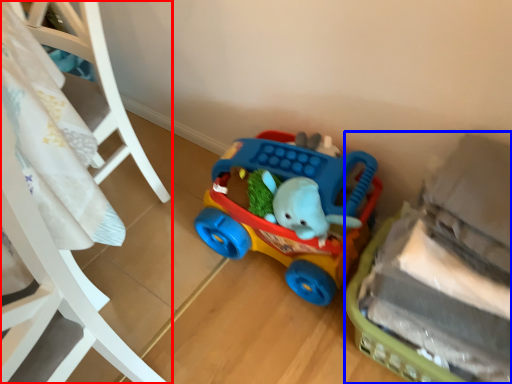
Question: Which point is further to the camera, furniture (highlighted by a red box) or toy (highlighted by a blue box)?

Choices:
 (A) furniture
 (B) toy

Answer: (B)